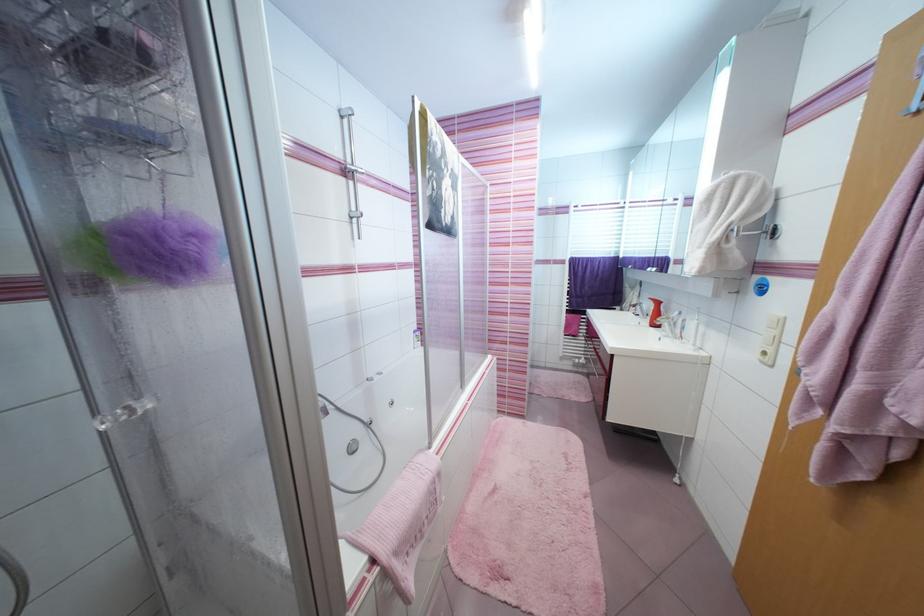
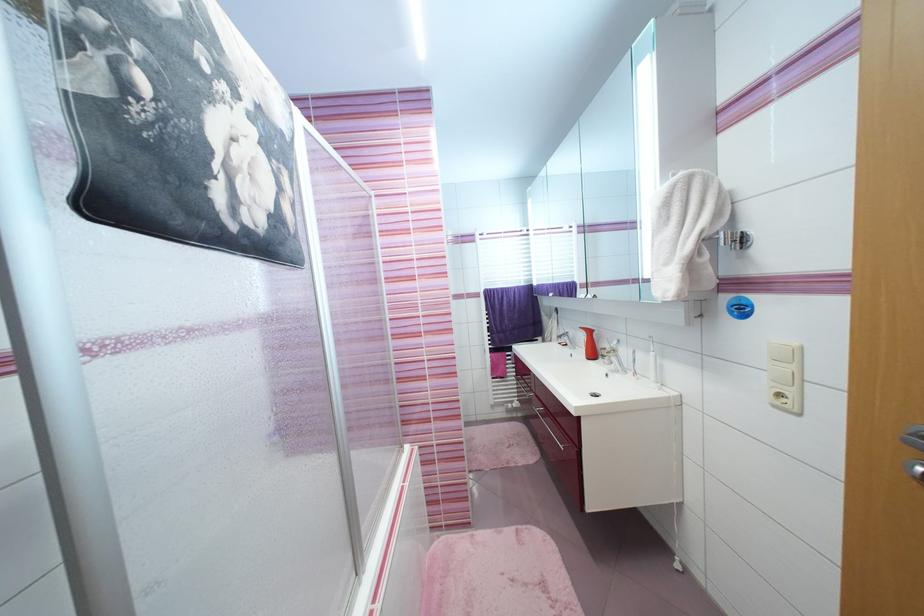
Question: In a continuous first-person perspective shot, in which direction is the camera moving?

Choices:
 (A) Left
 (B) Right
 (C) Forward
 (D) Backward

Answer: (C)